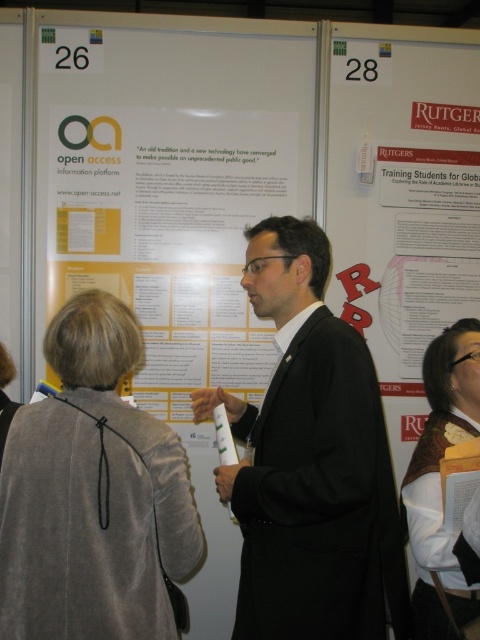
Question: Is black matte suit at center in front of white fabric scarf at center?

Choices:
 (A) no
 (B) yes

Answer: (B)

Question: Does black matte suit at center have a smaller size compared to velvet gray blazer at center?

Choices:
 (A) no
 (B) yes

Answer: (A)

Question: Considering the real-world distances, which object is closest to the velvet gray blazer at center?

Choices:
 (A) black matte suit at center
 (B) white fabric scarf at center

Answer: (A)

Question: Is black matte suit at center closer to the viewer compared to velvet gray blazer at center?

Choices:
 (A) yes
 (B) no

Answer: (B)

Question: Which point appears closest to the camera in this image?

Choices:
 (A) (64, 324)
 (B) (420, 608)
 (C) (255, 627)

Answer: (A)

Question: Which point is farther to the camera?

Choices:
 (A) (123, 404)
 (B) (276, 493)
 (C) (468, 612)

Answer: (C)